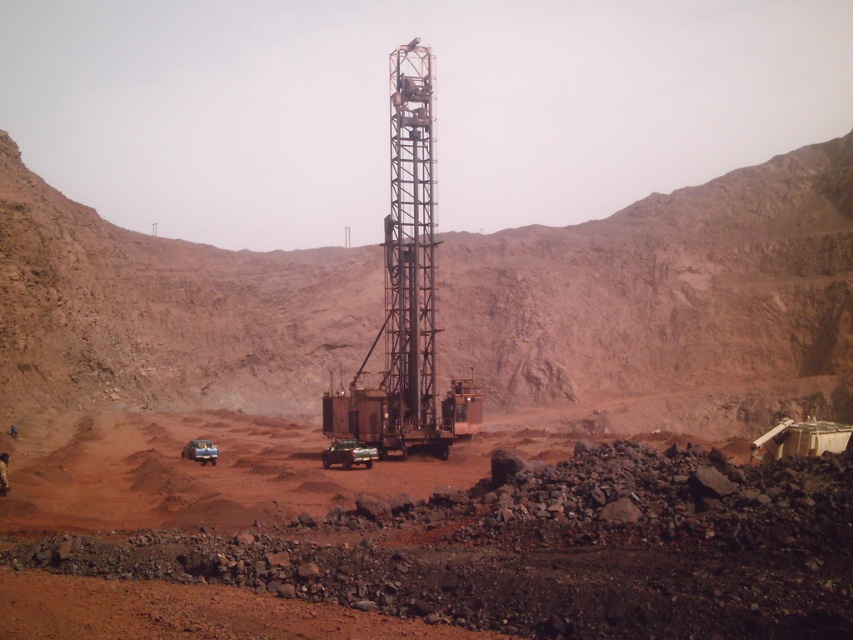
You are a safety inspector at the mining site. You need to walk from the dusty red soil at center to the metallic silver truck at lower left. The path is clear but the area is unstable. What is the minimum safe distance you should maintain between your path and the edge of the pit? The pit edge is 100 feet away from the truck.

The distance between the dusty red soil at center and the metallic silver truck at lower left is 99.63 feet. Since the pit edge is 100 feet away from the truck, the inspector should stay at least 0.37 feet away from the edge to ensure safety.

You are a geologist examining the mining site. You need to determine which object occupies more space in the image between the dusty red soil at center and the metallic silver truck at lower left. Based on the scene, which one is larger?

The dusty red soil at center is bigger than the metallic silver truck at lower left, so the dusty red soil at center occupies more space in the image.

In the scene shown: You are a safety inspector standing at the edge of the open pit mine. You need to walk from your current position to the dusty red soil at center to collect a sample. However, there is a rustic metal drilling rig at center in the way. Can you walk around the rig to reach the soil without going through it?

The dusty red soil at center is located below the rustic metal drilling rig at center, so you can walk around the rig to reach the soil since it is positioned below the rig and not blocking the path directly.